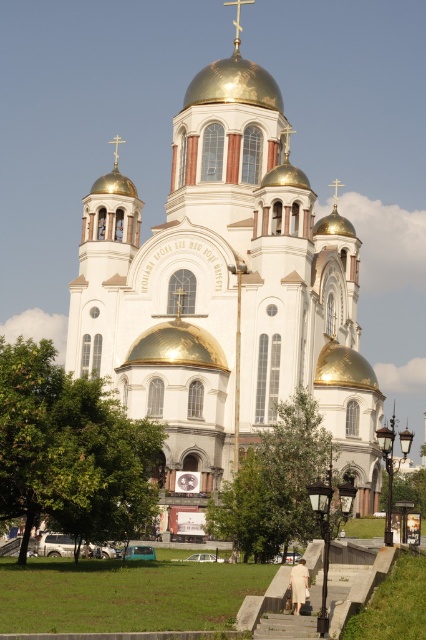
Question: Estimate the real-world distances between objects in this image. Which object is farther from the gold polished dome at center?

Choices:
 (A) white polished stone church at center
 (B) gold metallic dome at center

Answer: (B)

Question: Does white polished stone church at center appear over gold metallic dome at center?

Choices:
 (A) yes
 (B) no

Answer: (A)

Question: Considering the real-world distances, which object is closest to the gold polished dome at center?

Choices:
 (A) white polished stone church at center
 (B) gold metallic dome at center

Answer: (A)

Question: Estimate the real-world distances between objects in this image. Which object is closer to the white polished stone church at center?

Choices:
 (A) gold polished dome at center
 (B) gold metallic dome at center

Answer: (B)

Question: Is white polished stone church at center above gold metallic dome at center?

Choices:
 (A) yes
 (B) no

Answer: (A)

Question: Can you confirm if gold polished dome at center is positioned to the right of gold metallic dome at center?

Choices:
 (A) yes
 (B) no

Answer: (B)